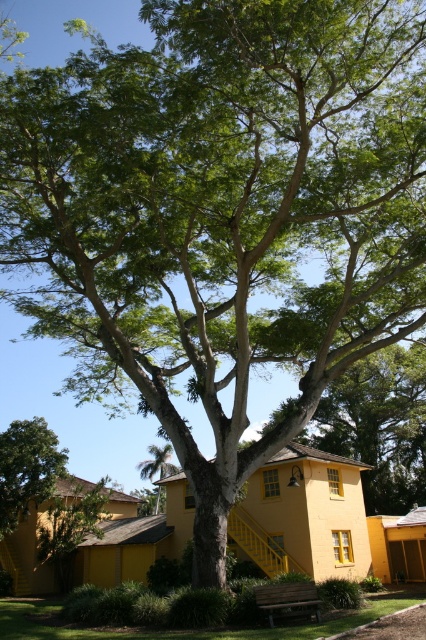
You are standing in the scene and want to walk towards the green leafy tree at lower left. Which direction should you move relative to the green grass at lower center?

To reach the green leafy tree at lower left from the green grass at lower center, you should move towards the left since the tree is positioned to the left of the grass.

You are standing in the middle of the scene and want to walk towards the green leafy tree at lower left. Which direction should you move to avoid stepping on the green grass at lower center?

The green grass at lower center is positioned on the right side of green leafy tree at lower left, so you should move to the left side of the tree to avoid stepping on the grass.